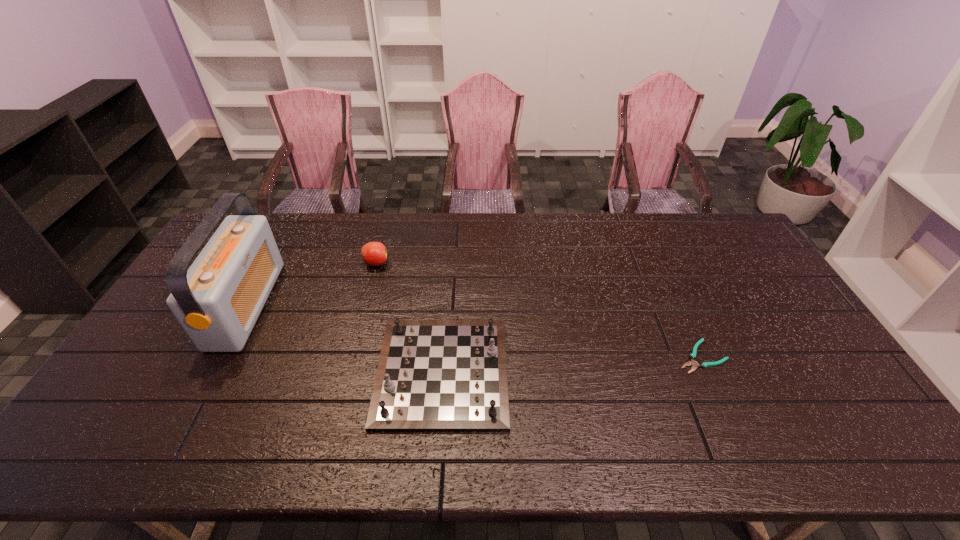
In order to click on the leftmost object in this screenshot , I will do `click(217, 301)`.

Find the location of a particular element. The height and width of the screenshot is (540, 960). the tallest object is located at coordinates (217, 301).

At what (x,y) coordinates should I click in order to perform the action: click on the third object from right to left. Please return your answer as a coordinate pair (x, y). The height and width of the screenshot is (540, 960). Looking at the image, I should click on (374, 253).

The height and width of the screenshot is (540, 960). I want to click on chessboard, so click(x=433, y=375).

Where is `the second object from right to left`? Image resolution: width=960 pixels, height=540 pixels. the second object from right to left is located at coordinates (433, 375).

Find the location of a particular element. the shortest object is located at coordinates (693, 356).

Identify the location of pliers. This screenshot has width=960, height=540. (693, 356).

This screenshot has width=960, height=540. Find the location of `vacant space located on the front-facing side of the tallest object`. vacant space located on the front-facing side of the tallest object is located at coordinates (338, 305).

Locate an element on the screen. The height and width of the screenshot is (540, 960). vacant space situated on the right of the apple is located at coordinates (476, 264).

Locate an element on the screen. vacant space situated 0.260m on the board of the chessboard is located at coordinates (604, 372).